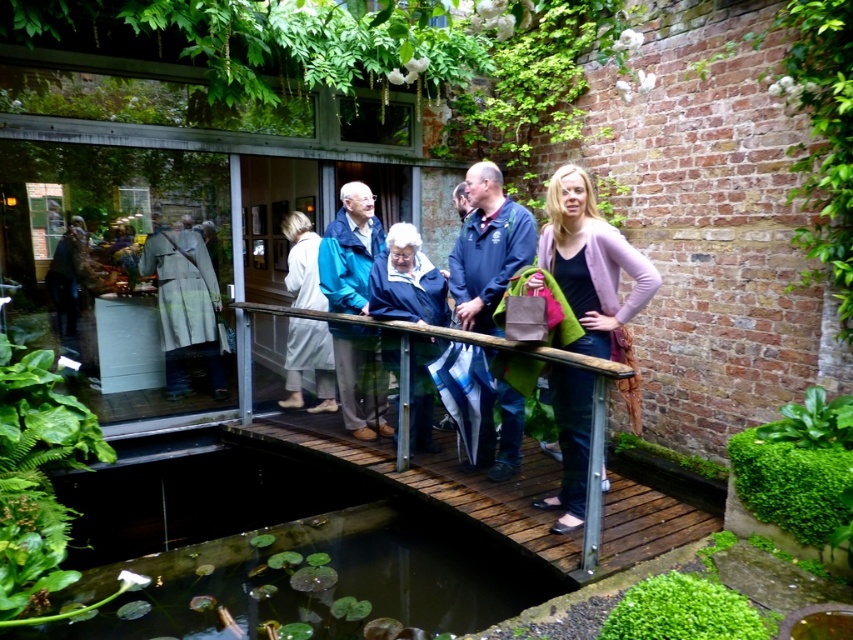
Which is in front, point (331, 620) or point (643, 604)?

Point (643, 604) is more forward.

How much distance is there between green leafy pond at lower left and green mossy patch at lower right?

green leafy pond at lower left is 4.70 feet away from green mossy patch at lower right.

Find the location of a particular element. The height and width of the screenshot is (640, 853). green leafy pond at lower left is located at coordinates (311, 580).

Does point (683, 605) come in front of point (308, 291)?

Yes, it is.

Image resolution: width=853 pixels, height=640 pixels. What do you see at coordinates (682, 611) in the screenshot? I see `green mossy patch at lower right` at bounding box center [682, 611].

Find the location of a particular element. This screenshot has width=853, height=640. green mossy patch at lower right is located at coordinates (682, 611).

Who is higher up, green leafy pond at lower left or blue fabric jacket at center?

blue fabric jacket at center

Is green leafy pond at lower left positioned at the back of blue fabric jacket at center?

No, it is not.

Which is behind, point (461, 589) or point (375, 312)?

Point (375, 312)

Find the location of `green leafy pond at lower left`. green leafy pond at lower left is located at coordinates (311, 580).